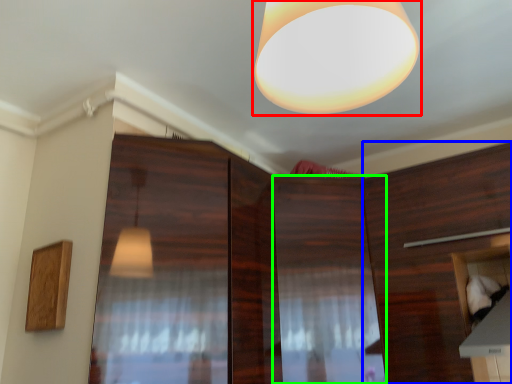
Question: Considering the real-world distances, which object is farthest from lamp (highlighted by a red box)? cabinetry (highlighted by a blue box) or cabinetry (highlighted by a green box)?

Choices:
 (A) cabinetry
 (B) cabinetry

Answer: (A)